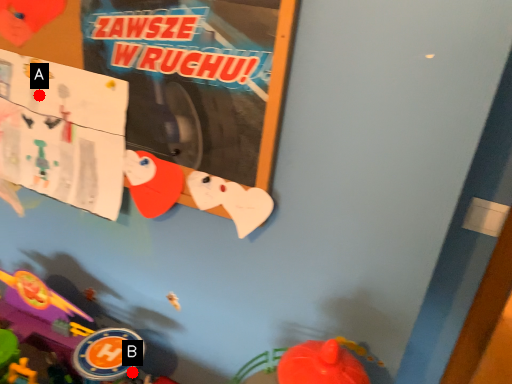
Question: Two points are circled on the image, labeled by A and B beside each circle. Which point is farther to the camera?

Choices:
 (A) A is further
 (B) B is further

Answer: (B)